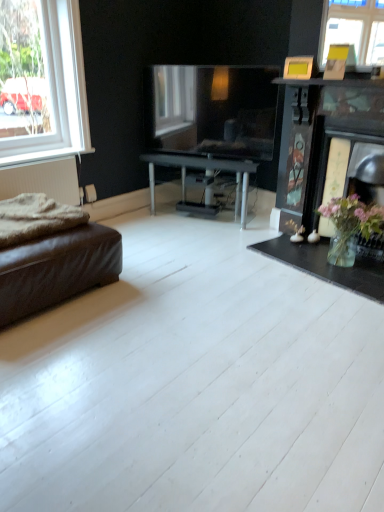
The width and height of the screenshot is (384, 512). What do you see at coordinates (326, 265) in the screenshot?
I see `clear glass vase at lower right` at bounding box center [326, 265].

What do you see at coordinates (58, 90) in the screenshot? The image size is (384, 512). I see `white plastic window at upper left` at bounding box center [58, 90].

Image resolution: width=384 pixels, height=512 pixels. Find the location of `clear glass vase at lower right`. clear glass vase at lower right is located at coordinates (326, 265).

The image size is (384, 512). Identify the location of blanket below the white plastic window at upper left (from the image's perspective). (35, 218).

From the image's perspective, is white plastic window at upper left over beige woolen blanket at lower left?

Indeed, from the image's perspective, white plastic window at upper left is shown above beige woolen blanket at lower left.

From a real-world perspective, is white plastic window at upper left beneath beige woolen blanket at lower left?

Actually, white plastic window at upper left is physically above beige woolen blanket at lower left in the real world.

Considering the sizes of objects white plastic window at upper left and beige woolen blanket at lower left in the image provided, who is shorter, white plastic window at upper left or beige woolen blanket at lower left?

Standing shorter between the two is beige woolen blanket at lower left.

Does beige woolen blanket at lower left have a lesser width compared to white plastic window at upper left?

In fact, beige woolen blanket at lower left might be wider than white plastic window at upper left.

Is the position of beige woolen blanket at lower left more distant than that of white plastic window at upper left?

No, it is in front of white plastic window at upper left.

Consider the image. Is beige woolen blanket at lower left to the left of white plastic window at upper left from the viewer's perspective?

In fact, beige woolen blanket at lower left is to the right of white plastic window at upper left.

Is beige woolen blanket at lower left far from white plastic window at upper left?

beige woolen blanket at lower left is actually quite close to white plastic window at upper left.

Find the location of `blanket on the left of the clear glass vase at lower right`. blanket on the left of the clear glass vase at lower right is located at coordinates (35, 218).

Do you think clear glass vase at lower right is within beige woolen blanket at lower left, or outside of it?

clear glass vase at lower right cannot be found inside beige woolen blanket at lower left.

Can you confirm if clear glass vase at lower right is taller than beige woolen blanket at lower left?

No.

Considering the positions of objects clear glass vase at lower right and beige woolen blanket at lower left in the image provided, who is more to the left, clear glass vase at lower right or beige woolen blanket at lower left?

Positioned to the left is beige woolen blanket at lower left.

In the scene shown: From a real-world perspective, which object rests below the other?

In real-world perspective, clear glass vase at lower right is lower.

Measure the distance from clear glass vase at lower right to brown leather studio couch at lower left.

clear glass vase at lower right is 4.72 feet away from brown leather studio couch at lower left.

Is clear glass vase at lower right directly adjacent to brown leather studio couch at lower left?

No, clear glass vase at lower right is not touching brown leather studio couch at lower left.

Who is smaller, clear glass vase at lower right or brown leather studio couch at lower left?

clear glass vase at lower right is smaller.

The height and width of the screenshot is (512, 384). I want to click on studio couch below the beige woolen blanket at lower left (from a real-world perspective), so (x=52, y=256).

Which object is closer to the camera, brown leather studio couch at lower left or beige woolen blanket at lower left?

brown leather studio couch at lower left is in front.

How many degrees apart are the facing directions of brown leather studio couch at lower left and beige woolen blanket at lower left?

The angle between the facing direction of brown leather studio couch at lower left and the facing direction of beige woolen blanket at lower left is 4.38 degrees.

Is brown leather studio couch at lower left positioned with its back to beige woolen blanket at lower left?

brown leather studio couch at lower left is not turned away from beige woolen blanket at lower left.

Relative to white plastic window at upper left, is clear glass vase at lower right in front or behind?

clear glass vase at lower right is in front of white plastic window at upper left.

I want to click on coffee table located in front of the white plastic window at upper left, so click(x=326, y=265).

Does white plastic window at upper left have a lesser height compared to clear glass vase at lower right?

Incorrect, the height of white plastic window at upper left does not fall short of that of clear glass vase at lower right.

Considering the relative positions of white plastic window at upper left and clear glass vase at lower right in the image provided, is white plastic window at upper left in front of clear glass vase at lower right?

No, the depth of white plastic window at upper left is greater than that of clear glass vase at lower right.

Are white plastic window at upper left and clear glass vase at lower right far apart?

Yes, white plastic window at upper left is far from clear glass vase at lower right.

Identify the location of coffee table in front of the white plastic window at upper left. Image resolution: width=384 pixels, height=512 pixels. (326, 265).

Image resolution: width=384 pixels, height=512 pixels. Identify the location of blanket on the right of white plastic window at upper left. (35, 218).

This screenshot has width=384, height=512. I want to click on blanket below the white plastic window at upper left (from a real-world perspective), so click(x=35, y=218).

Estimate the real-world distances between objects in this image. Which object is further from clear glass vase at lower right, brown leather studio couch at lower left or beige woolen blanket at lower left?

beige woolen blanket at lower left is positioned further to the anchor clear glass vase at lower right.

From the picture: Looking at the image, which one is located further to brown leather studio couch at lower left, white plastic window at upper left or clear glass vase at lower right?

The object further to brown leather studio couch at lower left is clear glass vase at lower right.

Looking at the image, which one is located closer to beige woolen blanket at lower left, clear glass vase at lower right or white plastic window at upper left?

white plastic window at upper left is closer to beige woolen blanket at lower left.

From the picture: Estimate the real-world distances between objects in this image. Which object is closer to brown leather studio couch at lower left, clear glass vase at lower right or beige woolen blanket at lower left?

beige woolen blanket at lower left lies closer to brown leather studio couch at lower left than the other object.

Which object lies further to the anchor point beige woolen blanket at lower left, brown leather studio couch at lower left or white plastic window at upper left?

white plastic window at upper left is positioned further to the anchor beige woolen blanket at lower left.

Which object lies nearer to the anchor point clear glass vase at lower right, beige woolen blanket at lower left or white plastic window at upper left?

beige woolen blanket at lower left lies closer to clear glass vase at lower right than the other object.

Looking at the image, which one is located closer to clear glass vase at lower right, white plastic window at upper left or brown leather studio couch at lower left?

brown leather studio couch at lower left is positioned closer to the anchor clear glass vase at lower right.

When comparing their distances from brown leather studio couch at lower left, does beige woolen blanket at lower left or clear glass vase at lower right seem closer?

Based on the image, beige woolen blanket at lower left appears to be nearer to brown leather studio couch at lower left.

Where is `blanket between white plastic window at upper left and brown leather studio couch at lower left vertically`? The image size is (384, 512). blanket between white plastic window at upper left and brown leather studio couch at lower left vertically is located at coordinates (35, 218).

You are a GUI agent. You are given a task and a screenshot of the screen. Output one action in this format:
    pyautogui.click(x=<x>, y=<y>)
    Task: Click on the blanket between white plastic window at upper left and clear glass vase at lower right
    The height and width of the screenshot is (512, 384).
    Given the screenshot: What is the action you would take?
    click(x=35, y=218)

This screenshot has height=512, width=384. In order to click on blanket between brown leather studio couch at lower left and clear glass vase at lower right in this screenshot , I will do `click(35, 218)`.

Locate an element on the screen. This screenshot has width=384, height=512. studio couch between white plastic window at upper left and clear glass vase at lower right in the horizontal direction is located at coordinates (52, 256).